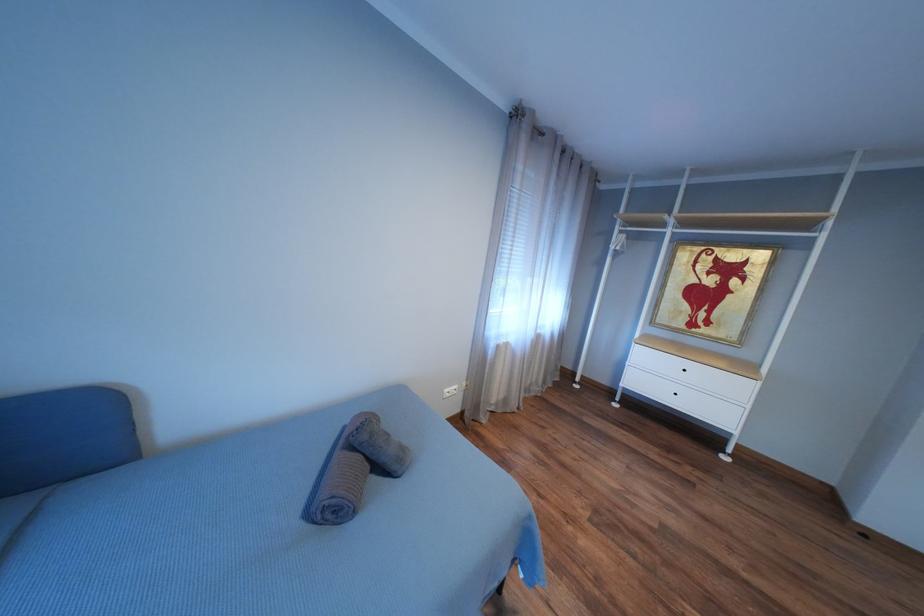
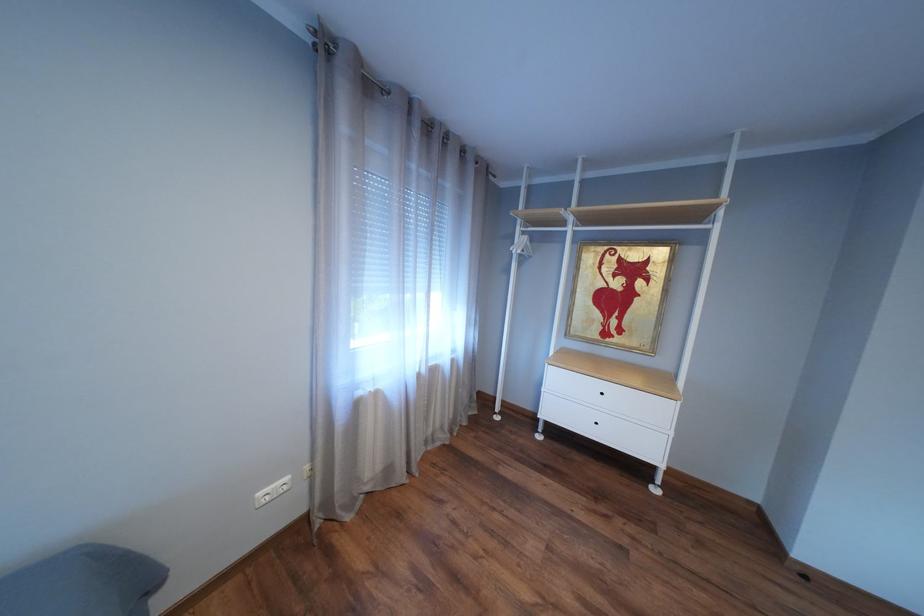
The images are taken continuously from a first-person perspective. In which direction are you moving?

The movement direction of the cameraman is right, forward.